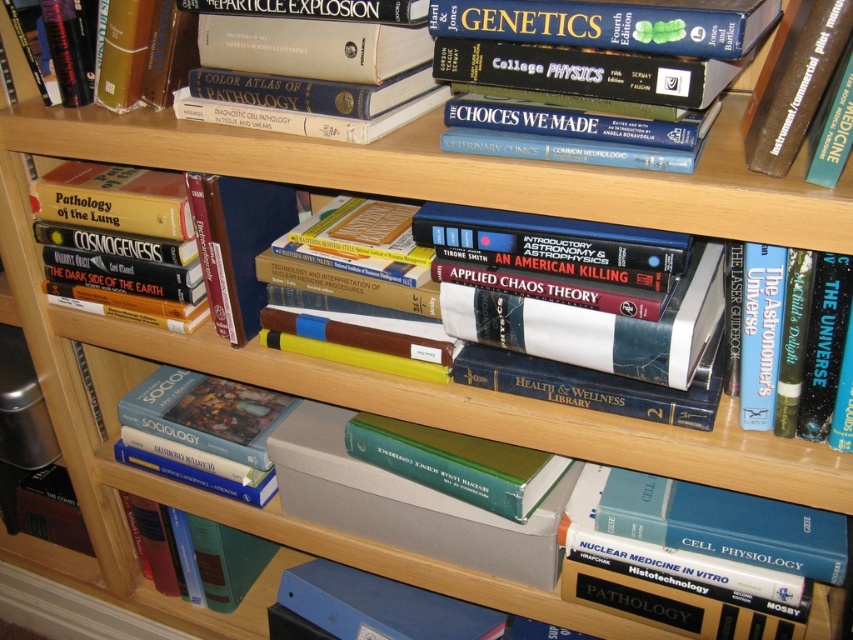
You are organizing the second shelf of the bookshelf. You need to place a new book between the hardcover book at center and the blue hardcover book at right. Where should you place it?

The new book should be placed between the hardcover book at center and the blue hardcover book at right since the hardcover book at center is to the left of the blue hardcover book at right.

You are looking at the second shelf of the bookshelf. You see a hardcover book at upper center and a hardcover book at upper right. Which book is closer to you?

The hardcover book at upper center is closer to you because the hardcover book at upper right is behind it.

You are organizing the bookshelf and want to place a new book between the blue hardcover book at right and the hardcover book at lower left. Which book should you place the new book closer to if you want it to be shorter than both?

You should place the new book closer to the blue hardcover book at right because it has a lesser height compared to the hardcover book at lower left.